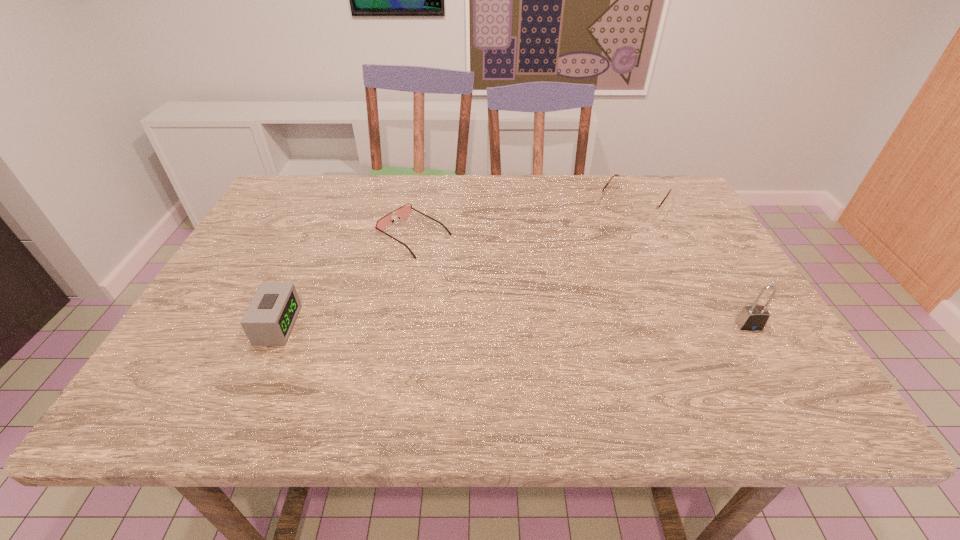
Locate an element on the screen. The width and height of the screenshot is (960, 540). free spot between the second object from left to right and the spectacles is located at coordinates coord(524,218).

At what (x,y) coordinates should I click in order to perform the action: click on free area in between the tallest object and the second object from left to right. Please return your answer as a coordinate pair (x, y). The height and width of the screenshot is (540, 960). Looking at the image, I should click on (581, 280).

This screenshot has width=960, height=540. Find the location of `vacant point located between the padlock and the spectacles`. vacant point located between the padlock and the spectacles is located at coordinates (691, 264).

Where is `vacant area that lies between the sunglasses and the padlock`? Image resolution: width=960 pixels, height=540 pixels. vacant area that lies between the sunglasses and the padlock is located at coordinates (581, 280).

You are a GUI agent. You are given a task and a screenshot of the screen. Output one action in this format:
    pyautogui.click(x=<x>, y=<y>)
    Task: Click on the vacant area that lies between the spectacles and the tallest object
    This screenshot has height=540, width=960.
    Given the screenshot: What is the action you would take?
    pyautogui.click(x=691, y=264)

You are a GUI agent. You are given a task and a screenshot of the screen. Output one action in this format:
    pyautogui.click(x=<x>, y=<y>)
    Task: Click on the free space between the second object from left to right and the third shortest object
    The height and width of the screenshot is (540, 960).
    Given the screenshot: What is the action you would take?
    pyautogui.click(x=346, y=280)

Locate an element on the screen. vacant area that lies between the sunglasses and the leftmost object is located at coordinates (346, 280).

Find the location of `vacant area that lies between the sunglasses and the tallest object`. vacant area that lies between the sunglasses and the tallest object is located at coordinates (581, 280).

Locate which object ranks third in proximity to the padlock. Please provide its 2D coordinates. Your answer should be formatted as a tuple, i.e. [(x, y)], where the tuple contains the x and y coordinates of a point satisfying the conditions above.

[(271, 315)]

Identify which object is the second closest to the sunglasses. Please provide its 2D coordinates. Your answer should be formatted as a tuple, i.e. [(x, y)], where the tuple contains the x and y coordinates of a point satisfying the conditions above.

[(640, 210)]